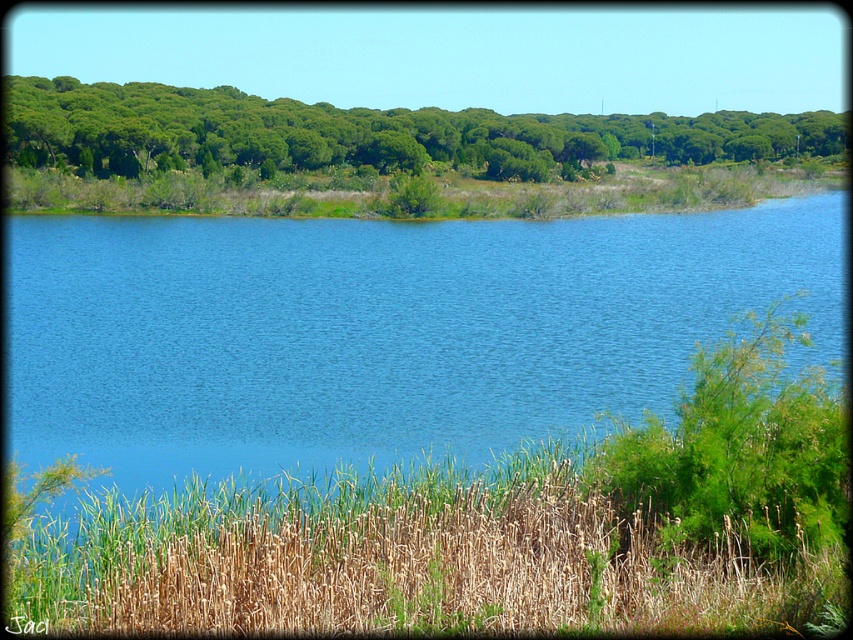
You are standing at the center of the image and want to move towards the green dry grass at lower center located at point [412,561]. Which direction should you head?

The green dry grass at lower center is located at point [412,561], which is to the lower right direction from the center of the image. You should head towards the lower right direction to reach it.

You are standing at the edge of the lake and see the green dry grass at lower center and the green leafy trees at upper center. Which object is closer to your left side?

The green dry grass at lower center is positioned on the left side of green leafy trees at upper center, so it is closer to your left side.